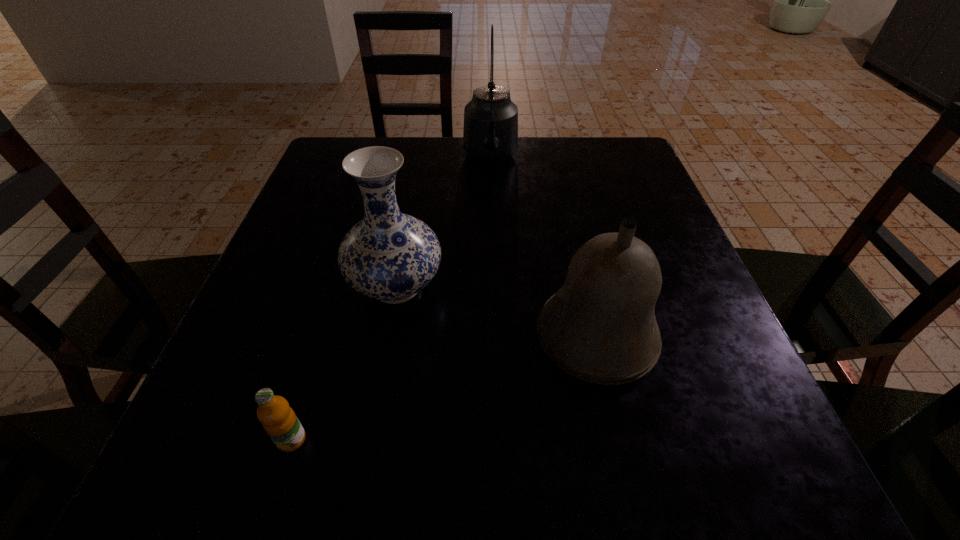
At what (x,y) coordinates should I click in order to perform the action: click on kettle. Please return your answer as a coordinate pair (x, y). This screenshot has width=960, height=540. Looking at the image, I should click on (490, 134).

Find the location of a particular element. vase is located at coordinates (389, 256).

Find the location of a particular element. Image resolution: width=960 pixels, height=540 pixels. bell is located at coordinates (600, 327).

You are a GUI agent. You are given a task and a screenshot of the screen. Output one action in this format:
    pyautogui.click(x=<x>, y=<y>)
    Task: Click on the shortest object
    The height and width of the screenshot is (540, 960).
    Given the screenshot: What is the action you would take?
    pyautogui.click(x=279, y=420)

At what (x,y) coordinates should I click in order to perform the action: click on orange juice. Please return your answer as a coordinate pair (x, y). The height and width of the screenshot is (540, 960). Looking at the image, I should click on (279, 420).

Find the location of `free space located 0.150m spout on the kettle`. free space located 0.150m spout on the kettle is located at coordinates (492, 219).

Where is `free space located 0.100m on the front of the vase`? free space located 0.100m on the front of the vase is located at coordinates [380, 376].

You are a GUI agent. You are given a task and a screenshot of the screen. Output one action in this format:
    pyautogui.click(x=<x>, y=<y>)
    Task: Click on the free space located on the right of the bell
    The image size is (960, 540).
    Given the screenshot: What is the action you would take?
    [687, 338]

Find the location of a particular element. object that is at the far edge is located at coordinates (490, 134).

Where is `object located at the near edge`? object located at the near edge is located at coordinates (279, 420).